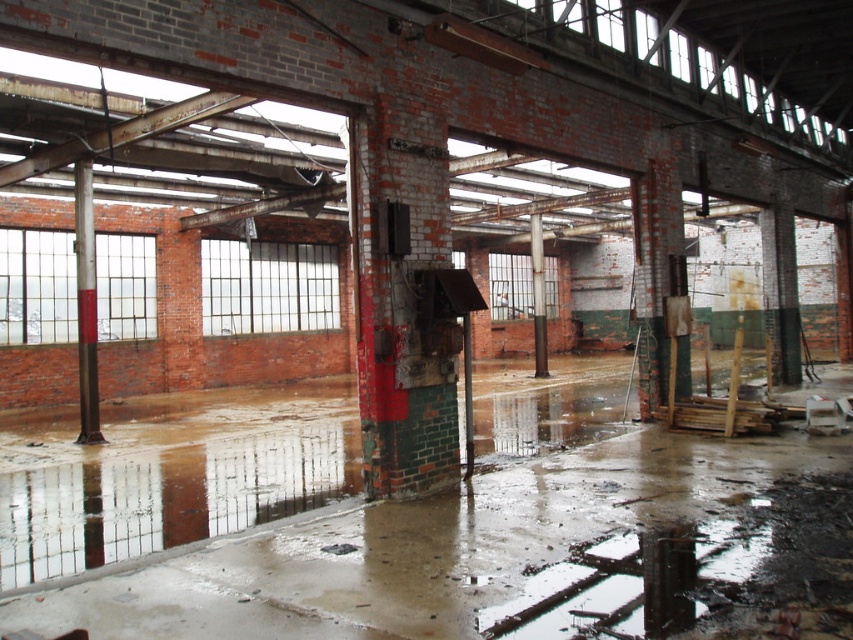
Between rusty metal pillar at center and brown wood pillar at center, which one appears on the right side from the viewer's perspective?

Positioned to the right is brown wood pillar at center.

Consider the image. Is rusty metal pillar at center positioned behind brown wood pillar at center?

No, it is not.

Locate an element on the screen. This screenshot has width=853, height=640. rusty metal pillar at center is located at coordinates (402, 298).

Does rusty metal pillar at center appear under red painted steel pole at left?

Incorrect, rusty metal pillar at center is not positioned below red painted steel pole at left.

Which is below, rusty metal pillar at center or red painted steel pole at left?

Positioned lower is red painted steel pole at left.

Find the location of a particular element. Image resolution: width=853 pixels, height=640 pixels. rusty metal pillar at center is located at coordinates coord(402,298).

Can you confirm if red painted steel pole at left is positioned below brown wood pillar at center?

Yes, red painted steel pole at left is below brown wood pillar at center.

Is point (93, 227) behind point (534, 310)?

No, (93, 227) is closer to viewer.

Image resolution: width=853 pixels, height=640 pixels. I want to click on red painted steel pole at left, so click(86, 305).